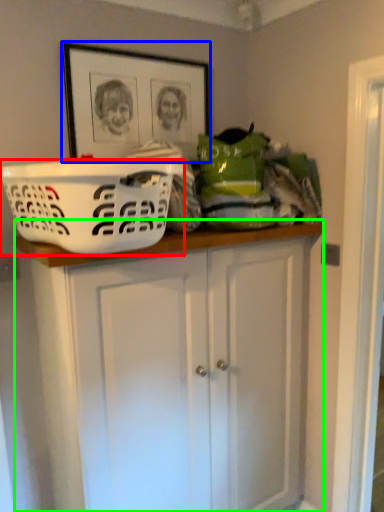
Question: Considering the real-world distances, which object is closest to basket (highlighted by a red box)? picture frame (highlighted by a blue box) or cabinetry (highlighted by a green box).

Choices:
 (A) picture frame
 (B) cabinetry

Answer: (B)